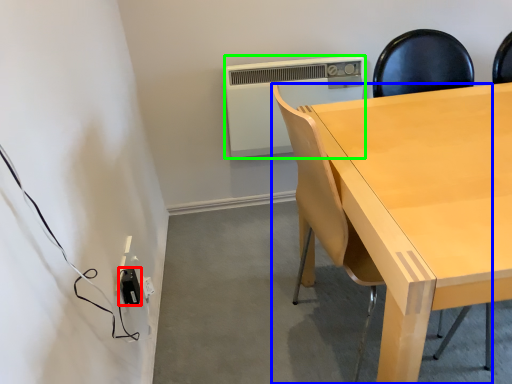
Question: Which object is positioned closest to electric outlet (highlighted by a red box)? Select from chair (highlighted by a blue box) and air conditioning (highlighted by a green box).

Choices:
 (A) chair
 (B) air conditioning

Answer: (A)